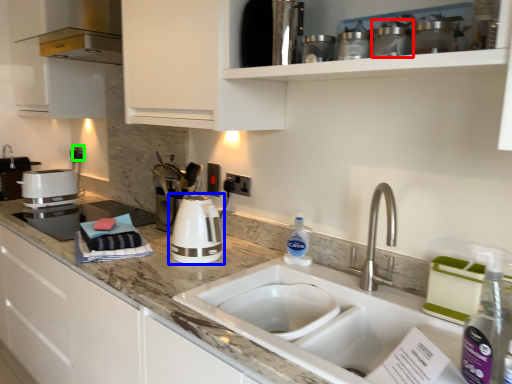
Question: Based on their relative distances, which object is nearer to appliance (highlighted by a red box)? Choose from home appliance (highlighted by a blue box) and electric outlet (highlighted by a green box).

Choices:
 (A) home appliance
 (B) electric outlet

Answer: (A)